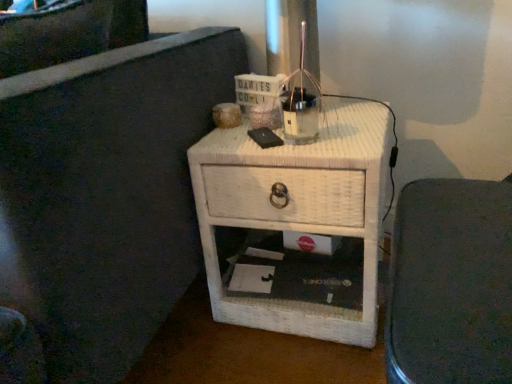
Question: Is white wicker nightstand at center positioned with its back to white wicker nightstand at center?

Choices:
 (A) no
 (B) yes

Answer: (A)

Question: Is white wicker nightstand at center taller than white wicker nightstand at center?

Choices:
 (A) no
 (B) yes

Answer: (B)

Question: From the image's perspective, is white wicker nightstand at center over white wicker nightstand at center?

Choices:
 (A) yes
 (B) no

Answer: (B)

Question: Is white wicker nightstand at center positioned in front of white wicker nightstand at center?

Choices:
 (A) no
 (B) yes

Answer: (B)

Question: Would you consider white wicker nightstand at center to be distant from white wicker nightstand at center?

Choices:
 (A) no
 (B) yes

Answer: (A)

Question: Does white wicker nightstand at center appear on the right side of white wicker nightstand at center?

Choices:
 (A) yes
 (B) no

Answer: (A)

Question: From the image's perspective, is white wicker nightstand at center below white wicker nightstand at center?

Choices:
 (A) no
 (B) yes

Answer: (A)

Question: Can you confirm if white wicker nightstand at center is shorter than white wicker nightstand at center?

Choices:
 (A) yes
 (B) no

Answer: (A)

Question: Does white wicker nightstand at center come behind white wicker nightstand at center?

Choices:
 (A) no
 (B) yes

Answer: (B)

Question: Does white wicker nightstand at center have a lesser width compared to white wicker nightstand at center?

Choices:
 (A) yes
 (B) no

Answer: (B)

Question: From a real-world perspective, is white wicker nightstand at center beneath white wicker nightstand at center?

Choices:
 (A) no
 (B) yes

Answer: (B)

Question: Can you confirm if white wicker nightstand at center is bigger than white wicker nightstand at center?

Choices:
 (A) yes
 (B) no

Answer: (A)

Question: Considering their positions, is white wicker nightstand at center located in front of or behind white wicker nightstand at center?

Choices:
 (A) behind
 (B) front

Answer: (B)